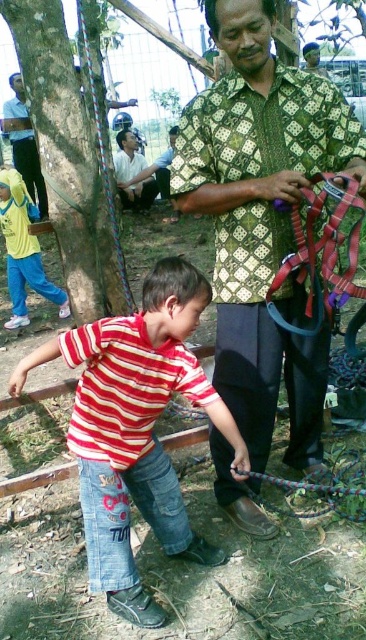
Question: Which point appears closest to the camera in this image?

Choices:
 (A) (9, 202)
 (B) (170, 340)
 (C) (361, 180)

Answer: (C)

Question: Which of these objects is positioned farthest from the yellow fabric shirt at left?

Choices:
 (A) green patterned shirt at center
 (B) light brown fabric shirt at upper center

Answer: (B)

Question: Is striped cotton shirt at center thinner than yellow fabric shirt at left?

Choices:
 (A) yes
 (B) no

Answer: (B)

Question: Is brown rough tree at upper left smaller than light brown fabric shirt at upper center?

Choices:
 (A) no
 (B) yes

Answer: (B)

Question: Among these objects, which one is nearest to the camera?

Choices:
 (A) green patterned shirt at center
 (B) yellow fabric shirt at left
 (C) striped cotton shirt at center
 (D) light brown fabric shirt at upper center

Answer: (C)

Question: Can you confirm if green patterned shirt at center is positioned to the right of brown rough tree at upper left?

Choices:
 (A) yes
 (B) no

Answer: (A)